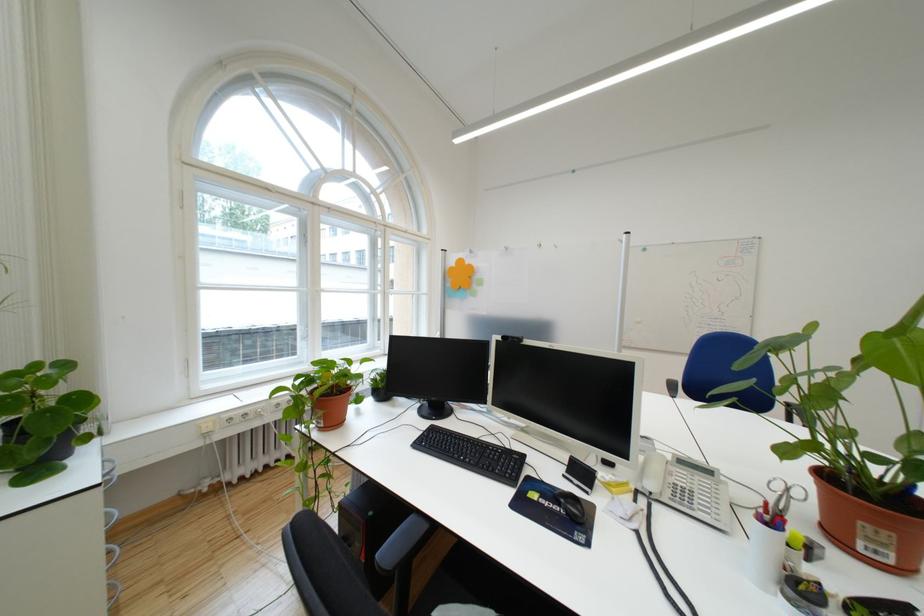
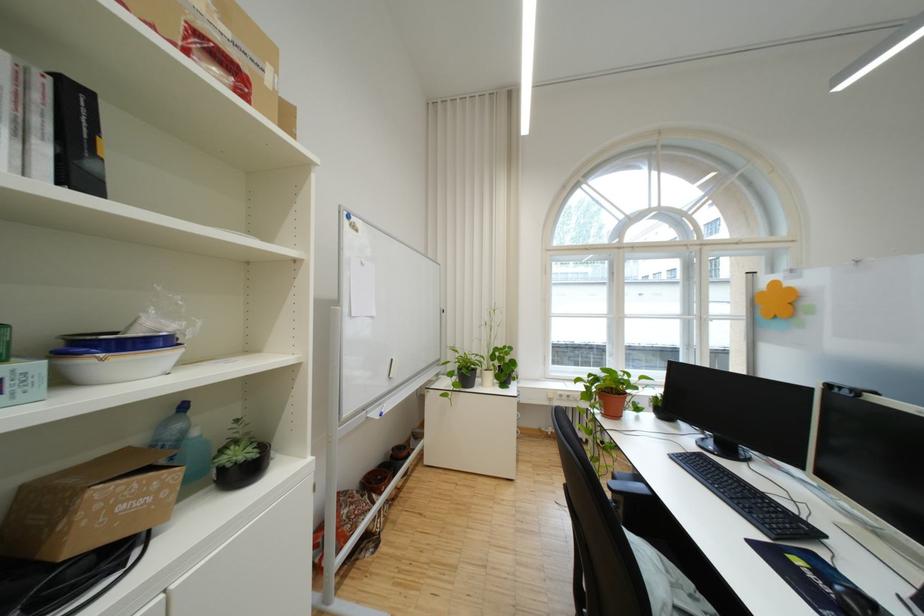
The point at [523,493] is marked in the first image. Where is the corresponding point in the second image?

(772, 539)